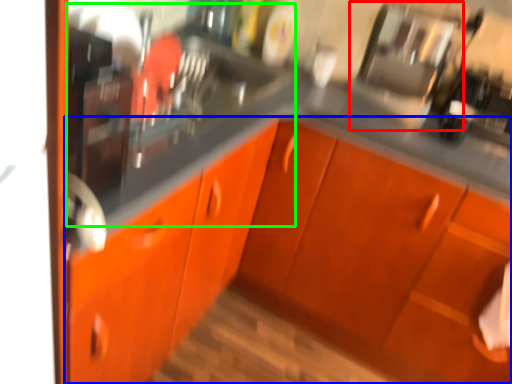
Question: Which is farther away from appliance (highlighted by a red box)? cabinetry (highlighted by a blue box) or sink (highlighted by a green box)?

Choices:
 (A) cabinetry
 (B) sink

Answer: (A)